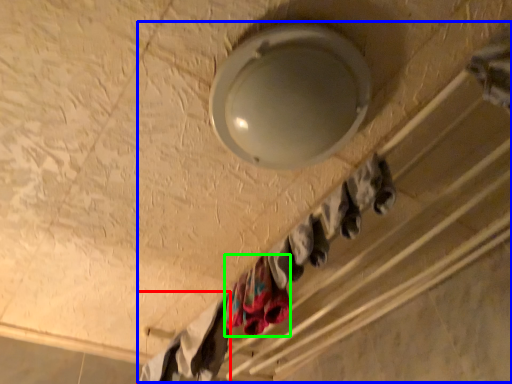
Question: Estimate the real-world distances between objects in this image. Which object is closer to clothing (highlighted by a red box), closet (highlighted by a blue box) or clothing (highlighted by a green box)?

Choices:
 (A) closet
 (B) clothing

Answer: (B)